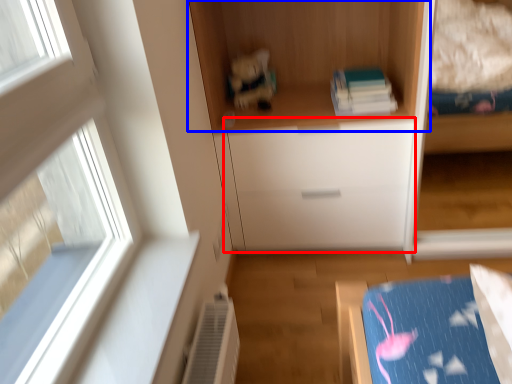
Question: Which object appears farthest to the camera in this image, drawer (highlighted by a red box) or cupboard (highlighted by a blue box)?

Choices:
 (A) drawer
 (B) cupboard

Answer: (A)